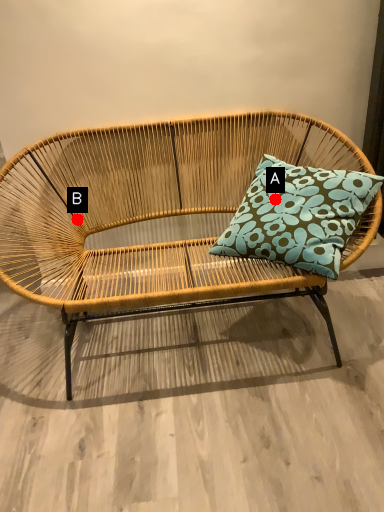
Question: Two points are circled on the image, labeled by A and B beside each circle. Which of the following is the closest to the observer?

Choices:
 (A) A is closer
 (B) B is closer

Answer: (A)